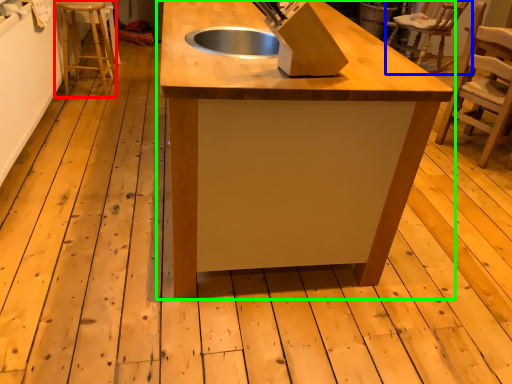
Question: Based on their relative distances, which object is nearer to step stool (highlighted by a red box)? Choose from chair (highlighted by a blue box) and table (highlighted by a green box).

Choices:
 (A) chair
 (B) table

Answer: (B)